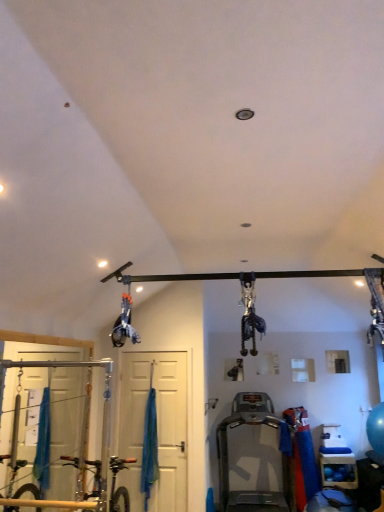
Question: Looking at the image, does blue rubber balls at lower right seem bigger or smaller compared to blue fabric curtain at center?

Choices:
 (A) small
 (B) big

Answer: (B)

Question: Is blue rubber balls at lower right spatially inside blue fabric curtain at center, or outside of it?

Choices:
 (A) outside
 (B) inside

Answer: (A)

Question: Estimate the real-world distances between objects in this image. Which object is closer to the blue fabric curtain at center?

Choices:
 (A) blue rubber balls at lower right
 (B) white matte door at center
 (C) silver metallic treadmill at center

Answer: (B)

Question: Which is nearer to the blue rubber balls at lower right?

Choices:
 (A) white matte door at center
 (B) silver metallic treadmill at center
 (C) blue fabric curtain at center

Answer: (B)